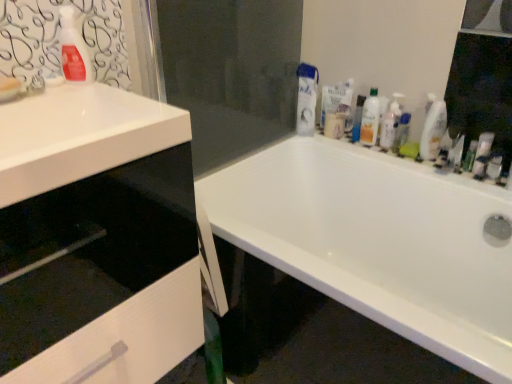
This screenshot has width=512, height=384. Find the location of `white matte fabric at upper right, which is counted as the second cleaning product, starting from the left`. white matte fabric at upper right, which is counted as the second cleaning product, starting from the left is located at coordinates (306, 99).

Find the location of a particular element. white glossy bottle at upper right, marked as the 1th cleaning product in a right-to-left arrangement is located at coordinates (432, 129).

Locate an element on the screen. This screenshot has height=384, width=512. green matte tube at right, placed as the second toiletry when sorted from front to back is located at coordinates (469, 156).

The height and width of the screenshot is (384, 512). Describe the element at coordinates (469, 156) in the screenshot. I see `green matte tube at right, which is the second toiletry in left-to-right order` at that location.

Describe the element at coordinates (401, 132) in the screenshot. I see `translucent plastic mouthwash at upper right` at that location.

In order to face translucent plastic bottle at upper right, the third cleaning product when ordered from right to left, should I rotate leftwards or rightwards?

Turn right approximately 15.196 degrees to face it.

The width and height of the screenshot is (512, 384). Find the location of `white matte fabric at upper right, which is the 1th cleaning product in back-to-front order`. white matte fabric at upper right, which is the 1th cleaning product in back-to-front order is located at coordinates (306, 99).

Is white glossy bottle at upper right, marked as the second cleaning product in a front-to-back arrangement, not within translucent plastic bottle at upper right, the 2th cleaning product when ordered from back to front?

Indeed, white glossy bottle at upper right, marked as the second cleaning product in a front-to-back arrangement, is completely outside translucent plastic bottle at upper right, the 2th cleaning product when ordered from back to front.

From a real-world perspective, relative to translucent plastic bottle at upper right, the third cleaning product when ordered from right to left, is white glossy bottle at upper right, marked as the second cleaning product in a front-to-back arrangement, vertically above or below?

From a real-world perspective, white glossy bottle at upper right, marked as the second cleaning product in a front-to-back arrangement, is physically below translucent plastic bottle at upper right, the third cleaning product when ordered from right to left.

Is white glossy bottle at upper right, marked as the 1th cleaning product in a right-to-left arrangement, far from translucent plastic bottle at upper right, the 3th cleaning product from the left?

No.

Is white glossy bottle at upper right, marked as the 1th cleaning product in a right-to-left arrangement, facing away from translucent plastic bottle at upper right, the fourth cleaning product from the front?

No, white glossy bottle at upper right, marked as the 1th cleaning product in a right-to-left arrangement,'s orientation is not away from translucent plastic bottle at upper right, the fourth cleaning product from the front.

Which object is more forward, white matte fabric at upper right, which ranks as the fourth cleaning product in right-to-left order, or white glossy cabinet at left?

Positioned in front is white glossy cabinet at left.

From a real-world perspective, is white matte fabric at upper right, which ranks as the fourth cleaning product in right-to-left order, physically above white glossy cabinet at left?

Yes, from a real-world perspective, white matte fabric at upper right, which ranks as the fourth cleaning product in right-to-left order, is over white glossy cabinet at left

In terms of width, does white matte fabric at upper right, positioned as the fifth cleaning product in front-to-back order, look wider or thinner when compared to white glossy cabinet at left?

white matte fabric at upper right, positioned as the fifth cleaning product in front-to-back order, is thinner than white glossy cabinet at left.

Is white matte fabric at upper right, which is counted as the second cleaning product, starting from the left, turned away from white glossy cabinet at left?

No.

From the image's perspective, which one is positioned lower, white glossy bottle at upper right, acting as the fifth cleaning product starting from the left, or clear plastic tube at upper right, marked as the first toiletry in a right-to-left arrangement?

clear plastic tube at upper right, marked as the first toiletry in a right-to-left arrangement.

Is white glossy bottle at upper right, acting as the fifth cleaning product starting from the left, to the right of clear plastic tube at upper right, positioned as the 3th toiletry in back-to-front order, from the viewer's perspective?

No, white glossy bottle at upper right, acting as the fifth cleaning product starting from the left, is not to the right of clear plastic tube at upper right, positioned as the 3th toiletry in back-to-front order.

The width and height of the screenshot is (512, 384). I want to click on the 2nd cleaning product located above the clear plastic tube at upper right, marked as the 3th toiletry in a left-to-right arrangement (from a real-world perspective), so click(432, 129).

Between white glossy bottle at upper right, placed as the 4th cleaning product when sorted from back to front, and clear plastic tube at upper right, positioned as the 3th toiletry in back-to-front order, which one has smaller width?

With smaller width is white glossy bottle at upper right, placed as the 4th cleaning product when sorted from back to front.

Which of these two, white glossy cabinet at left or green matte tube at right, placed as the second toiletry when sorted from front to back, stands taller?

With more height is white glossy cabinet at left.

Would you say white glossy cabinet at left is inside or outside green matte tube at right, which is the 2th toiletry from right to left?

white glossy cabinet at left is not enclosed by green matte tube at right, which is the 2th toiletry from right to left.

Is white glossy cabinet at left facing towards green matte tube at right, which is the 2th toiletry from right to left?

No, white glossy cabinet at left is not facing towards green matte tube at right, which is the 2th toiletry from right to left.

Considering the relative positions of white glossy cabinet at left and green matte tube at right, positioned as the second toiletry in back-to-front order, in the image provided, is white glossy cabinet at left to the right of green matte tube at right, positioned as the second toiletry in back-to-front order, from the viewer's perspective?

Incorrect, white glossy cabinet at left is not on the right side of green matte tube at right, positioned as the second toiletry in back-to-front order.

Does point (425, 147) come behind point (381, 134)?

No, it is in front of (381, 134).

From a real-world perspective, does white glossy bottle at upper right, marked as the second cleaning product in a front-to-back arrangement, stand above translucent plastic pump bottle at upper right, which is the 2th cleaning product in right-to-left order?

Yes, from a real-world perspective, white glossy bottle at upper right, marked as the second cleaning product in a front-to-back arrangement, is above translucent plastic pump bottle at upper right, which is the 2th cleaning product in right-to-left order.

Which object is closer to the camera, white glossy bottle at upper right, marked as the 1th cleaning product in a right-to-left arrangement, or translucent plastic pump bottle at upper right, which is the 2th cleaning product in right-to-left order?

white glossy bottle at upper right, marked as the 1th cleaning product in a right-to-left arrangement, is more forward.

From the picture: Is there a large distance between white glossy cabinet at left and transparent glass screen door at center?

No, white glossy cabinet at left is not far from transparent glass screen door at center.

Which of these two, white glossy cabinet at left or transparent glass screen door at center, stands taller?

white glossy cabinet at left.

Is transparent glass screen door at center located within white glossy cabinet at left?

That's incorrect, transparent glass screen door at center is not inside white glossy cabinet at left.

Could you tell me if white glossy cabinet at left is turned towards transparent glass screen door at center?

No, white glossy cabinet at left is not oriented towards transparent glass screen door at center.

Could you tell me if white glossy sink at upper left is turned towards translucent plastic pump bottle at upper right, which is the 2th cleaning product in right-to-left order?

No, white glossy sink at upper left is not oriented towards translucent plastic pump bottle at upper right, which is the 2th cleaning product in right-to-left order.

Would you say white glossy sink at upper left is to the left or to the right of translucent plastic pump bottle at upper right, the third cleaning product when ordered from back to front, in the picture?

Clearly, white glossy sink at upper left is on the left of translucent plastic pump bottle at upper right, the third cleaning product when ordered from back to front, in the image.

Do you think white glossy sink at upper left is within translucent plastic pump bottle at upper right, the third cleaning product when ordered from back to front, or outside of it?

white glossy sink at upper left lies outside translucent plastic pump bottle at upper right, the third cleaning product when ordered from back to front.

Considering the sizes of objects white glossy sink at upper left and translucent plastic pump bottle at upper right, which is the 2th cleaning product in right-to-left order, in the image provided, who is smaller, white glossy sink at upper left or translucent plastic pump bottle at upper right, which is the 2th cleaning product in right-to-left order,?

translucent plastic pump bottle at upper right, which is the 2th cleaning product in right-to-left order.

Locate an element on the screen. the 2nd cleaning product below when counting from the translucent plastic bottle at upper right, the 2th cleaning product when ordered from back to front (from the image's perspective) is located at coordinates (432, 129).

Where is `cabinetry located underneath the white matte fabric at upper right, which ranks as the fourth cleaning product in right-to-left order (from a real-world perspective)`? Image resolution: width=512 pixels, height=384 pixels. cabinetry located underneath the white matte fabric at upper right, which ranks as the fourth cleaning product in right-to-left order (from a real-world perspective) is located at coordinates (96, 238).

Based on the photo, from the image, which object appears to be farther from white glossy cabinet at left, translucent plastic mouthwash at upper right or green matte tube at right, which is the 2th toiletry from right to left?

green matte tube at right, which is the 2th toiletry from right to left, is further to white glossy cabinet at left.

When comparing their distances from white glossy bottle at upper right, placed as the 4th cleaning product when sorted from back to front, does clear plastic tube at upper right, positioned as the 3th toiletry in back-to-front order, or matte plastic container at upper right, the third toiletry when ordered from right to left, seem further?

matte plastic container at upper right, the third toiletry when ordered from right to left.

Considering their positions, is translucent plastic spray bottle at upper left, which appears as the fifth cleaning product when viewed from the back, positioned closer to matte plastic container at upper right, the first toiletry in the back-to-front sequence, than white glossy bottle at upper right, placed as the 4th cleaning product when sorted from back to front?

Among the two, white glossy bottle at upper right, placed as the 4th cleaning product when sorted from back to front, is located nearer to matte plastic container at upper right, the first toiletry in the back-to-front sequence.

When comparing their distances from translucent plastic bottle at upper right, the 2th cleaning product when ordered from back to front, does green matte tube at right, which is the second toiletry in left-to-right order, or translucent plastic spray bottle at upper left, the first cleaning product positioned from the left, seem closer?

green matte tube at right, which is the second toiletry in left-to-right order, is closer to translucent plastic bottle at upper right, the 2th cleaning product when ordered from back to front.

Estimate the real-world distances between objects in this image. Which object is further from translucent plastic pump bottle at upper right, the third cleaning product viewed from the front, white glossy bathtub at center or white glossy cabinet at left?

white glossy cabinet at left is positioned further to the anchor translucent plastic pump bottle at upper right, the third cleaning product viewed from the front.

From the image, which object appears to be farther from translucent plastic spray bottle at upper left, the 5th cleaning product from the right, white matte fabric at upper right, which is the 1th cleaning product in back-to-front order, or matte plastic container at upper right, the first toiletry in the back-to-front sequence?

matte plastic container at upper right, the first toiletry in the back-to-front sequence, lies further to translucent plastic spray bottle at upper left, the 5th cleaning product from the right, than the other object.

Looking at the image, which one is located closer to white glossy bottle at upper right, marked as the 1th cleaning product in a right-to-left arrangement, green matte tube at right, which is the second toiletry in left-to-right order, or translucent plastic bottle at upper right, the third cleaning product when ordered from right to left?

Among the two, green matte tube at right, which is the second toiletry in left-to-right order, is located nearer to white glossy bottle at upper right, marked as the 1th cleaning product in a right-to-left arrangement.

From the image, which object appears to be farther from matte plastic container at upper right, the third toiletry when ordered from right to left, clear glass mirror at upper right or translucent plastic bottle at upper right, the fourth cleaning product from the front?

clear glass mirror at upper right is positioned further to the anchor matte plastic container at upper right, the third toiletry when ordered from right to left.

At what (x,y) coordinates should I click in order to perform the action: click on bathtub between white glossy cabinet at left and translucent plastic mouthwash at upper right from front to back. Please return your answer as a coordinate pair (x, y). The image size is (512, 384). Looking at the image, I should click on (378, 241).

The width and height of the screenshot is (512, 384). Find the location of `mouthwash located between white glossy bathtub at center and matte plastic container at upper right, the third toiletry from the front, in the depth direction`. mouthwash located between white glossy bathtub at center and matte plastic container at upper right, the third toiletry from the front, in the depth direction is located at coordinates (401, 132).

At what (x,y) coordinates should I click in order to perform the action: click on bathtub situated between white glossy cabinet at left and clear plastic tube at upper right, marked as the first toiletry in a right-to-left arrangement, from left to right. Please return your answer as a coordinate pair (x, y). The width and height of the screenshot is (512, 384). Looking at the image, I should click on (378, 241).

This screenshot has height=384, width=512. In order to click on mouthwash situated between transparent glass screen door at center and white glossy bottle at upper right, marked as the second cleaning product in a front-to-back arrangement, from left to right in this screenshot , I will do click(401, 132).